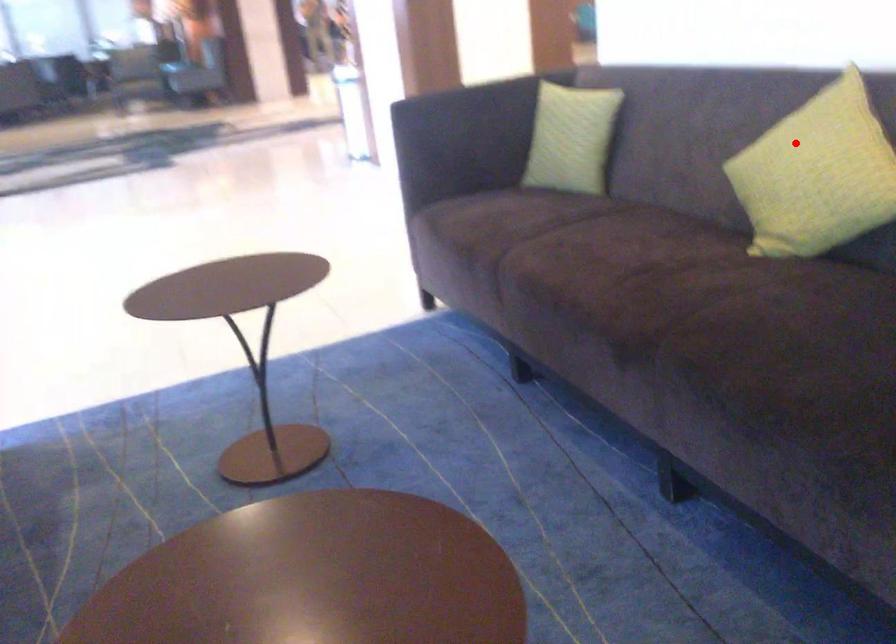
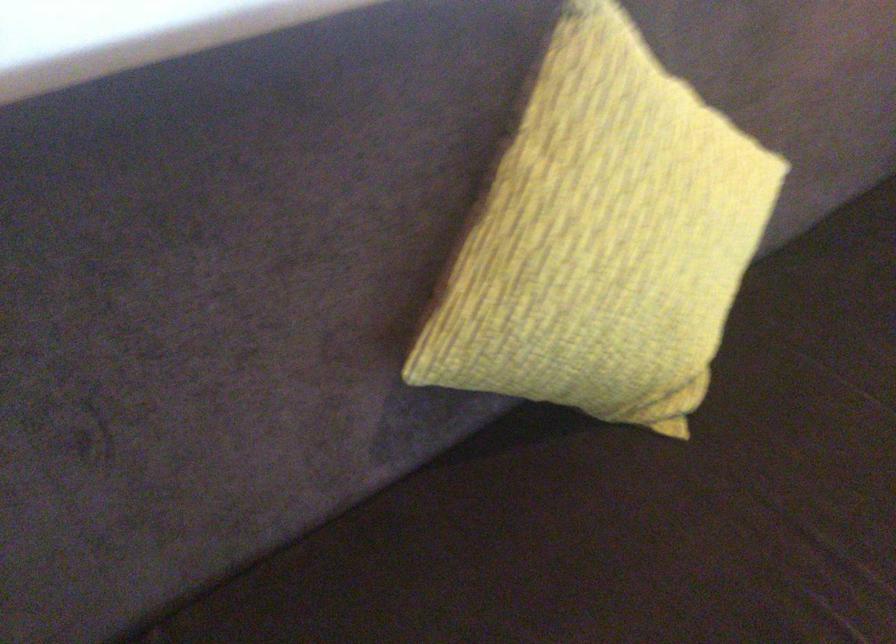
Question: I am providing you with two images of the same scene from different viewpoints. Image1 has a red point marked. In image2, the corresponding 3D location appears at what relative position? Reply with the corresponding letter.

Choices:
 (A) Closer
 (B) Farther

Answer: (A)